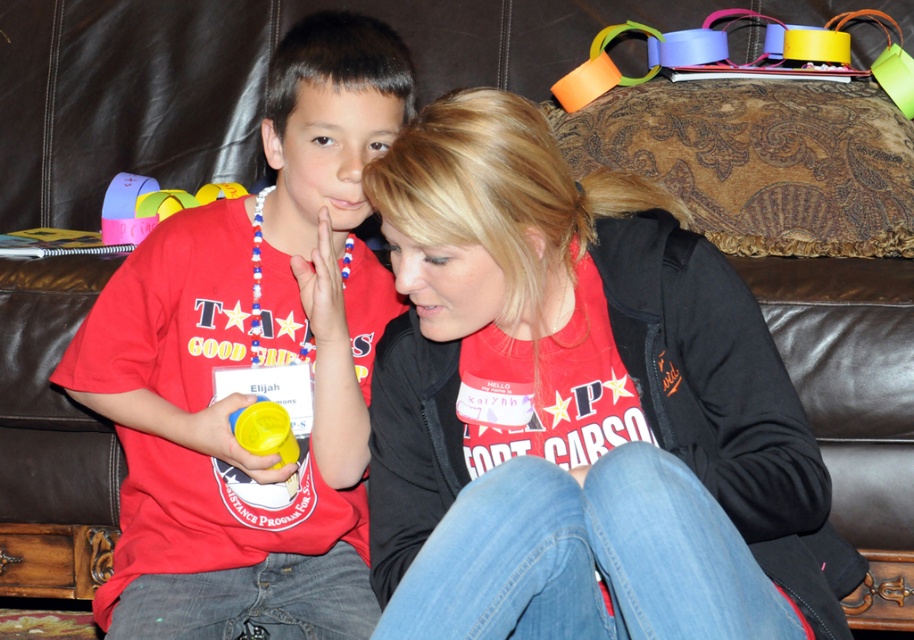
You are a photographer setting up for a group photo. The scene has a matte red shirt at center and a multicolored paper chain at upper right. You need to ensure that the distance between them is at least 1.2 meters to frame the shot properly. Based on the scene description, will the current positioning allow for this requirement?

The matte red shirt at center is 1.03 meters from the multicolored paper chain at upper right. Since 1.03 meters is less than the required 1.2 meters, the current positioning does not meet the distance requirement for proper framing.

You are standing in front of the couch where the young boy and woman are sitting. You need to reach a point located at coordinates point (x=768, y=476). If your arm can extend 1 meter, can you comfortably reach that point without moving your feet?

The distance between point (x=768, y=476) and the camera is 1.18 meters. Since your arm can only extend 1 meter, you cannot comfortably reach that point without moving your feet.